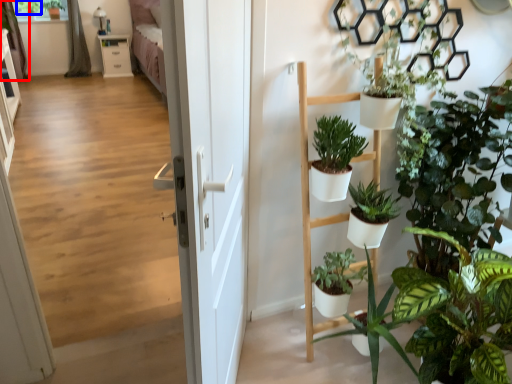
Question: Which object is closer to the camera taking this photo, curtain (highlighted by a red box) or plant (highlighted by a blue box)?

Choices:
 (A) curtain
 (B) plant

Answer: (A)